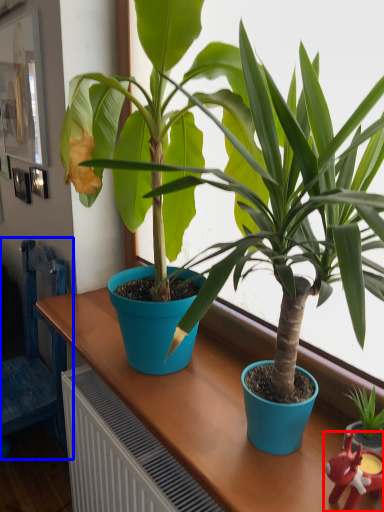
Question: Which object appears closest to the camera in this image, toy (highlighted by a red box) or chair (highlighted by a blue box)?

Choices:
 (A) toy
 (B) chair

Answer: (A)